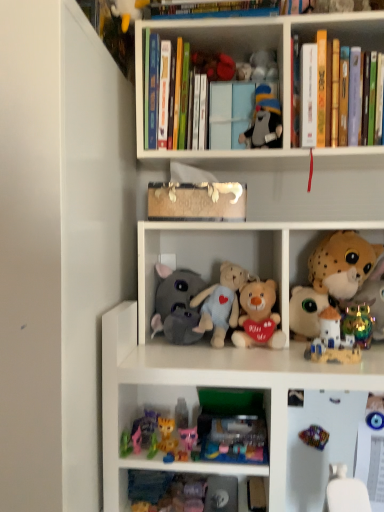
The width and height of the screenshot is (384, 512). I want to click on vacant area on top of wooden toy at center, the 1th book when ordered from left to right (from a real-world perspective), so click(x=193, y=178).